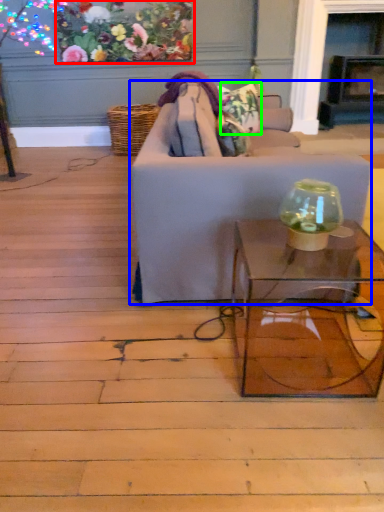
Question: Which is nearer to the floral arrangement (highlighted by a red box)? studio couch (highlighted by a blue box) or flower (highlighted by a green box).

Choices:
 (A) studio couch
 (B) flower

Answer: (B)